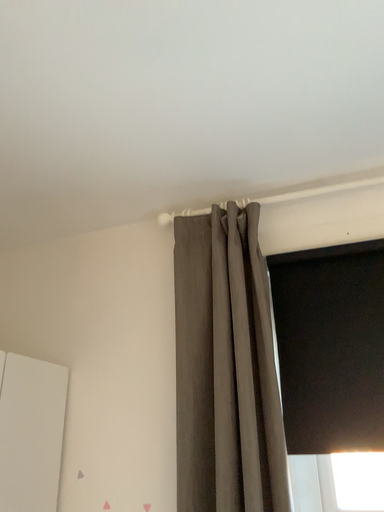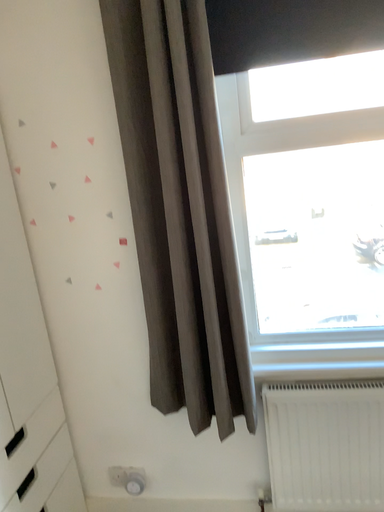
Question: Which way did the camera rotate in the video?

Choices:
 (A) rotated right
 (B) rotated left

Answer: (A)